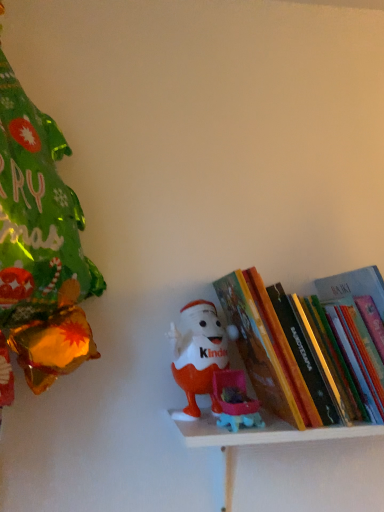
Question: Does hardcover book at center have a lesser height compared to matte plastic toy at center?

Choices:
 (A) yes
 (B) no

Answer: (B)

Question: Is hardcover book at center at the right side of matte plastic toy at center?

Choices:
 (A) yes
 (B) no

Answer: (A)

Question: Is hardcover book at center far from matte plastic toy at center?

Choices:
 (A) no
 (B) yes

Answer: (A)

Question: Is hardcover book at center oriented towards matte plastic toy at center?

Choices:
 (A) yes
 (B) no

Answer: (B)

Question: Is hardcover book at center in contact with matte plastic toy at center?

Choices:
 (A) no
 (B) yes

Answer: (A)

Question: From the image's perspective, relative to matte plastic toy at center, is plastic toy at center above or below?

Choices:
 (A) below
 (B) above

Answer: (A)

Question: Is plastic toy at center in front of or behind matte plastic toy at center in the image?

Choices:
 (A) behind
 (B) front

Answer: (B)

Question: From a real-world perspective, is plastic toy at center positioned above or below matte plastic toy at center?

Choices:
 (A) above
 (B) below

Answer: (B)

Question: Considering the positions of plastic toy at center and matte plastic toy at center in the image, is plastic toy at center wider or thinner than matte plastic toy at center?

Choices:
 (A) wide
 (B) thin

Answer: (A)

Question: Relative to plastic toy at center, is matte plastic toy at center in front or behind?

Choices:
 (A) behind
 (B) front

Answer: (A)

Question: From a real-world perspective, relative to plastic toy at center, is matte plastic toy at center vertically above or below?

Choices:
 (A) below
 (B) above

Answer: (B)

Question: From the image's perspective, relative to plastic toy at center, is matte plastic toy at center above or below?

Choices:
 (A) below
 (B) above

Answer: (B)

Question: Is point (200, 342) positioned closer to the camera than point (289, 434)?

Choices:
 (A) farther
 (B) closer

Answer: (A)

Question: From a real-world perspective, is plastic toy at center positioned above or below hardcover book at center?

Choices:
 (A) below
 (B) above

Answer: (A)

Question: From the image's perspective, is plastic toy at center positioned above or below hardcover book at center?

Choices:
 (A) above
 (B) below

Answer: (B)